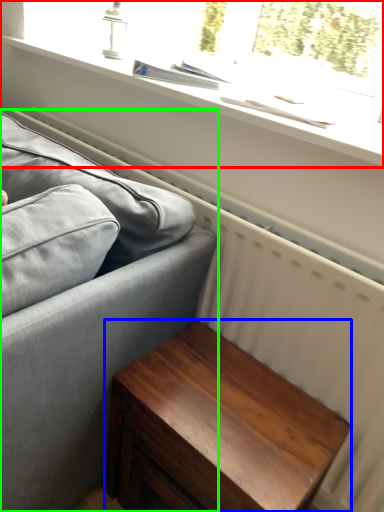
Question: Which object is positioned closest to window (highlighted by a red box)? Select from table (highlighted by a blue box) and studio couch (highlighted by a green box).

Choices:
 (A) table
 (B) studio couch

Answer: (B)